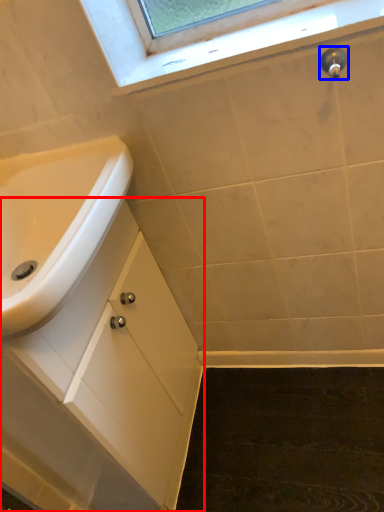
Question: Among these objects, which one is farthest to the camera, bathroom cabinet (highlighted by a red box) or plumbing fixture (highlighted by a blue box)?

Choices:
 (A) bathroom cabinet
 (B) plumbing fixture

Answer: (B)